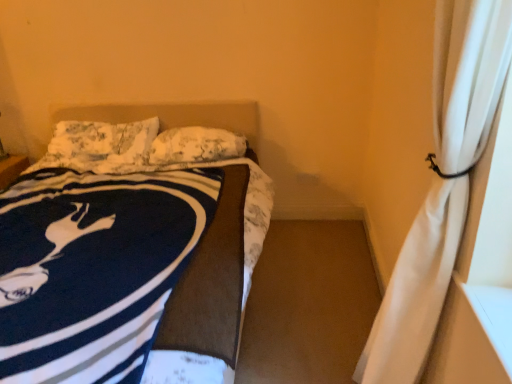
Question: Does white sheer curtain at right have a lesser width compared to fluffy white pillow at upper left, which is the 1th pillow in left-to-right order?

Choices:
 (A) no
 (B) yes

Answer: (B)

Question: Is white sheer curtain at right in contact with fluffy white pillow at upper left, which is the 1th pillow in left-to-right order?

Choices:
 (A) no
 (B) yes

Answer: (A)

Question: Is white sheer curtain at right at the left side of fluffy white pillow at upper left, which is the 1th pillow in left-to-right order?

Choices:
 (A) no
 (B) yes

Answer: (A)

Question: Is white sheer curtain at right positioned beyond the bounds of fluffy white pillow at upper left, which is the 1th pillow in left-to-right order?

Choices:
 (A) no
 (B) yes

Answer: (B)

Question: Is white sheer curtain at right at the right side of fluffy white pillow at upper left, which is the 1th pillow in left-to-right order?

Choices:
 (A) no
 (B) yes

Answer: (B)

Question: Is navy blue fleece blanket at left in front of or behind white textured pillow at center, placed as the 1th pillow when sorted from right to left, in the image?

Choices:
 (A) front
 (B) behind

Answer: (A)

Question: Is point (20, 319) positioned closer to the camera than point (154, 163)?

Choices:
 (A) farther
 (B) closer

Answer: (B)

Question: Based on their sizes in the image, would you say navy blue fleece blanket at left is bigger or smaller than white textured pillow at center, placed as the 1th pillow when sorted from right to left?

Choices:
 (A) small
 (B) big

Answer: (B)

Question: In the image, is navy blue fleece blanket at left on the left side or the right side of white textured pillow at center, placed as the 1th pillow when sorted from right to left?

Choices:
 (A) right
 (B) left

Answer: (B)

Question: From a real-world perspective, is white textured pillow at center, which appears as the 2th pillow when viewed from the left, above or below white sheer curtain at right?

Choices:
 (A) below
 (B) above

Answer: (A)

Question: In the image, is white textured pillow at center, placed as the 1th pillow when sorted from right to left, positioned in front of or behind white sheer curtain at right?

Choices:
 (A) behind
 (B) front

Answer: (A)

Question: Considering the positions of white textured pillow at center, placed as the 1th pillow when sorted from right to left, and white sheer curtain at right in the image, is white textured pillow at center, placed as the 1th pillow when sorted from right to left, wider or thinner than white sheer curtain at right?

Choices:
 (A) wide
 (B) thin

Answer: (A)

Question: Looking at the image, does white textured pillow at center, placed as the 1th pillow when sorted from right to left, seem bigger or smaller compared to white sheer curtain at right?

Choices:
 (A) big
 (B) small

Answer: (B)

Question: Is navy blue fleece blanket at left taller or shorter than white sheer curtain at right?

Choices:
 (A) short
 (B) tall

Answer: (A)

Question: From the image's perspective, is navy blue fleece blanket at left positioned above or below white sheer curtain at right?

Choices:
 (A) above
 (B) below

Answer: (A)